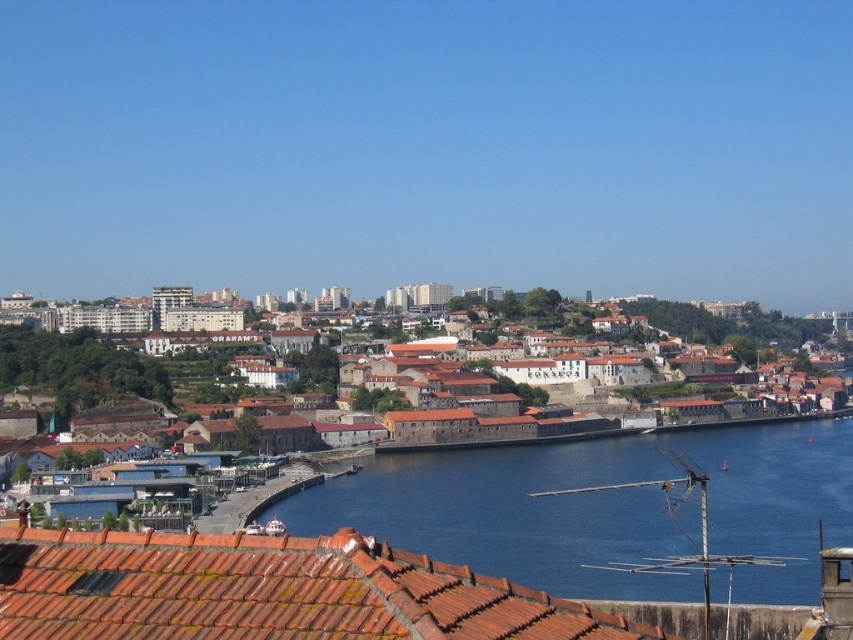
Can you confirm if blue water at center is positioned below brown stone buildings at center?

No.

Consider the image. Is blue water at center wider than brown stone buildings at center?

In fact, blue water at center might be narrower than brown stone buildings at center.

Who is more forward, (834, 432) or (817, 456)?

Positioned in front is point (817, 456).

Locate an element on the screen. blue water at center is located at coordinates (605, 508).

In the scene shown: Which is more to the left, terracotta tiles at lower center or brown stone buildings at center?

Positioned to the left is terracotta tiles at lower center.

Is terracotta tiles at lower center below brown stone buildings at center?

No.

Is point (30, 605) more distant than point (654, 435)?

No, (30, 605) is in front of (654, 435).

Locate an element on the screen. terracotta tiles at lower center is located at coordinates (267, 592).

Does point (749, 588) lie in front of point (27, 632)?

No, it is not.

Which is behind, point (606, 458) or point (527, 636)?

Positioned behind is point (606, 458).

Who is more distant from viewer, (485,456) or (161,618)?

Positioned behind is point (485,456).

Identify the location of blue water at center. Image resolution: width=853 pixels, height=640 pixels. (605, 508).